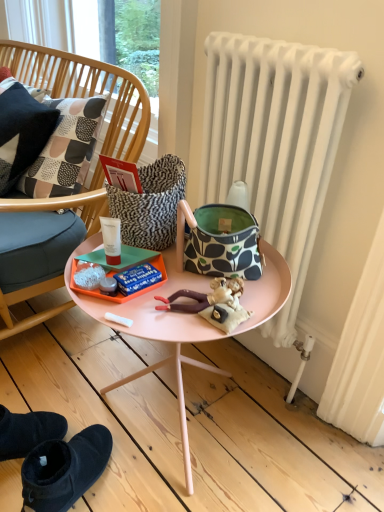
Question: From the image's perspective, would you say white matte radiator at right is shown under patterned fabric handbag at center?

Choices:
 (A) yes
 (B) no

Answer: (B)

Question: Is white matte radiator at right to the right of patterned fabric handbag at center from the viewer's perspective?

Choices:
 (A) yes
 (B) no

Answer: (A)

Question: Is white matte radiator at right turned away from patterned fabric handbag at center?

Choices:
 (A) yes
 (B) no

Answer: (A)

Question: Could patterned fabric handbag at center be considered to be inside white matte radiator at right?

Choices:
 (A) yes
 (B) no

Answer: (B)

Question: From the image's perspective, does white matte radiator at right appear higher than patterned fabric handbag at center?

Choices:
 (A) no
 (B) yes

Answer: (B)

Question: Is white matte radiator at right bigger than patterned fabric handbag at center?

Choices:
 (A) no
 (B) yes

Answer: (B)

Question: Does patterned fabric pillow at left have a smaller size compared to wooden chair at left?

Choices:
 (A) yes
 (B) no

Answer: (A)

Question: Is patterned fabric pillow at left turned away from wooden chair at left?

Choices:
 (A) no
 (B) yes

Answer: (B)

Question: From the image's perspective, is patterned fabric pillow at left on top of wooden chair at left?

Choices:
 (A) no
 (B) yes

Answer: (B)

Question: From a real-world perspective, is patterned fabric pillow at left under wooden chair at left?

Choices:
 (A) yes
 (B) no

Answer: (B)

Question: Is patterned fabric pillow at left at the right side of wooden chair at left?

Choices:
 (A) no
 (B) yes

Answer: (A)

Question: Does patterned fabric pillow at left have a greater height compared to wooden chair at left?

Choices:
 (A) yes
 (B) no

Answer: (B)

Question: From a real-world perspective, does wooden chair at left sit lower than patterned fabric handbag at center?

Choices:
 (A) no
 (B) yes

Answer: (B)